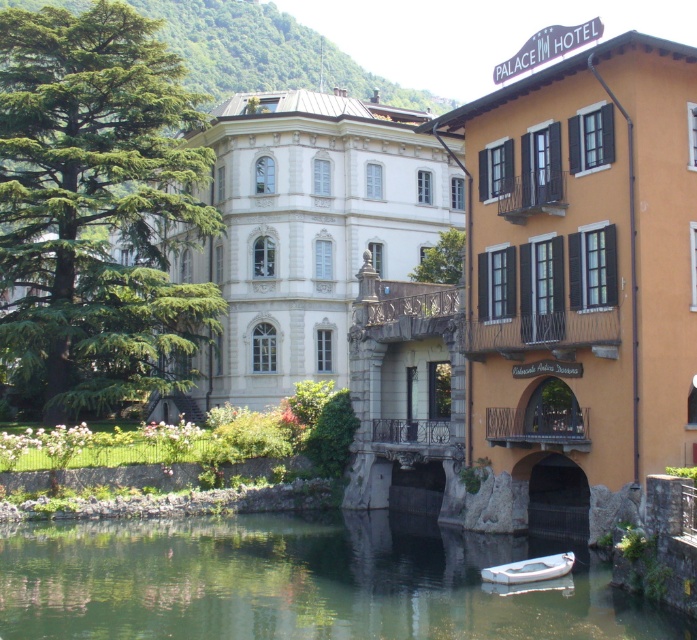
You are standing in front of the grand white building on the left. You notice two points marked on the ground in front of you. The first point is at coordinates point (114, 557) and the second is at point (482, 572). Which point is closer to your current position?

Point (114, 557) is closer to your current position because it is further to the camera than point (482, 572), meaning it is physically nearer to you.

You are standing at the edge of the green smooth water at lower center. Which direction should you walk to reach the grand, white building with classical architectural features on the left side?

Since the green smooth water at lower center is located at point [300,580], you should walk towards the left to reach the grand, white building with classical architectural features on the left side.